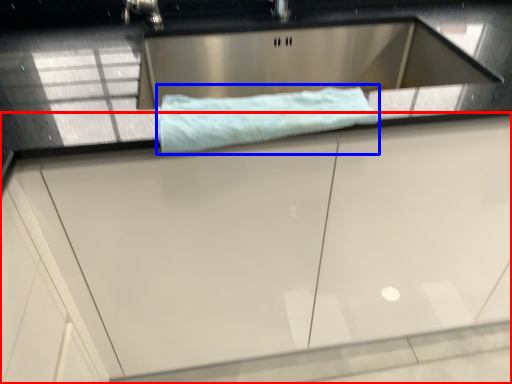
Question: Which of the following is the closest to the observer, cabinetry (highlighted by a red box) or bath towel (highlighted by a blue box)?

Choices:
 (A) cabinetry
 (B) bath towel

Answer: (A)